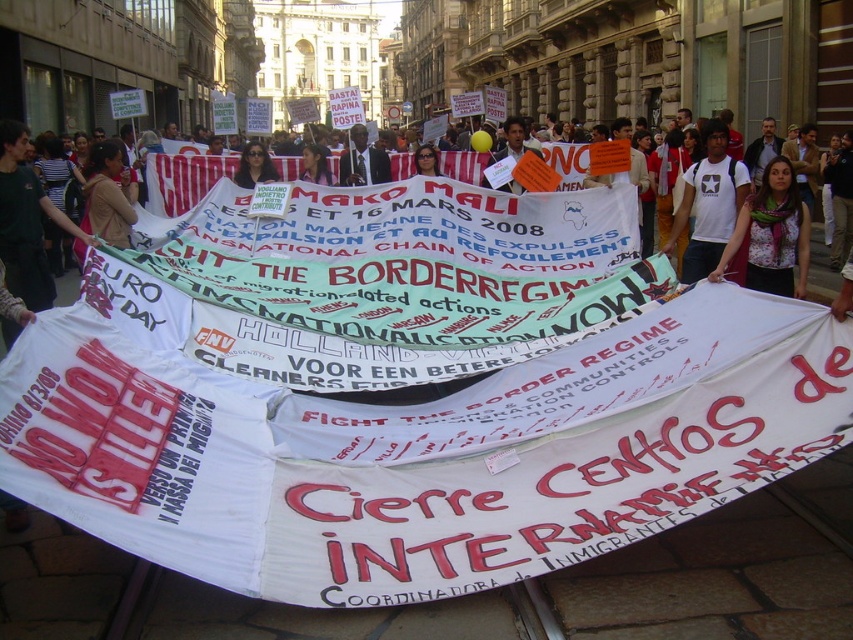
Question: Among these objects, which one is nearest to the camera?

Choices:
 (A) floral fabric scarf at center
 (B) matte black sunglasses at center

Answer: (A)

Question: Considering the relative positions of floral fabric scarf at center and white t-shirt at center in the image provided, where is floral fabric scarf at center located with respect to white t-shirt at center?

Choices:
 (A) right
 (B) left

Answer: (B)

Question: Which of the following is the farthest from the observer?

Choices:
 (A) dark skin man at center
 (B) floral fabric scarf at center

Answer: (A)

Question: Is dark skin man at center wider than matte black sunglasses at center?

Choices:
 (A) no
 (B) yes

Answer: (A)

Question: Based on their relative distances, which object is nearer to the matte black sunglasses at center?

Choices:
 (A) dark skin man at center
 (B) floral fabric scarf at center
 (C) white t-shirt at center

Answer: (A)

Question: Can you confirm if dark skin man at center is positioned above matte black sunglasses at center?

Choices:
 (A) no
 (B) yes

Answer: (B)